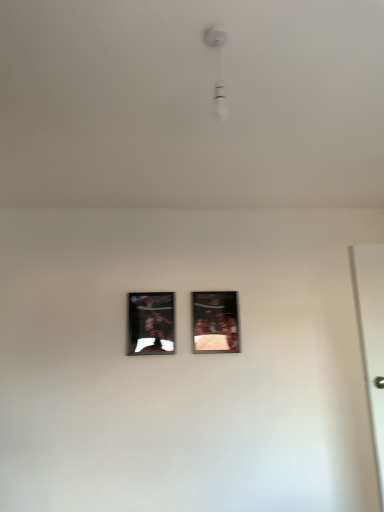
Image resolution: width=384 pixels, height=512 pixels. What are the coordinates of `metallic silver picture frame at center, which appears as the second picture frame when viewed from the left` in the screenshot? It's located at (215, 321).

Where is `metallic reflective frame at center, the 1th picture frame when ordered from left to right`? Image resolution: width=384 pixels, height=512 pixels. metallic reflective frame at center, the 1th picture frame when ordered from left to right is located at coordinates (151, 323).

The height and width of the screenshot is (512, 384). Describe the element at coordinates (217, 69) in the screenshot. I see `white glossy bulb at upper center` at that location.

Image resolution: width=384 pixels, height=512 pixels. In order to click on metallic silver picture frame at center, which is counted as the 1th picture frame, starting from the right in this screenshot , I will do `click(215, 321)`.

Considering the sizes of objects metallic silver picture frame at center, which is counted as the 1th picture frame, starting from the right, and metallic reflective frame at center, the 1th picture frame when ordered from left to right, in the image provided, who is wider, metallic silver picture frame at center, which is counted as the 1th picture frame, starting from the right, or metallic reflective frame at center, the 1th picture frame when ordered from left to right,?

With larger width is metallic silver picture frame at center, which is counted as the 1th picture frame, starting from the right.

Considering the positions of objects metallic silver picture frame at center, which is counted as the 1th picture frame, starting from the right, and metallic reflective frame at center, which is counted as the second picture frame, starting from the right, in the image provided, who is in front, metallic silver picture frame at center, which is counted as the 1th picture frame, starting from the right, or metallic reflective frame at center, which is counted as the second picture frame, starting from the right,?

metallic reflective frame at center, which is counted as the second picture frame, starting from the right.

Is metallic silver picture frame at center, which appears as the second picture frame when viewed from the left, facing towards metallic reflective frame at center, the 1th picture frame when ordered from left to right?

No, metallic silver picture frame at center, which appears as the second picture frame when viewed from the left, is not aimed at metallic reflective frame at center, the 1th picture frame when ordered from left to right.

Can you tell me how much metallic silver picture frame at center, which is counted as the 1th picture frame, starting from the right, and white glossy bulb at upper center differ in facing direction?

The angle between the facing direction of metallic silver picture frame at center, which is counted as the 1th picture frame, starting from the right, and the facing direction of white glossy bulb at upper center is 87.1 degrees.

Is metallic silver picture frame at center, which is counted as the 1th picture frame, starting from the right, spatially inside white glossy bulb at upper center, or outside of it?

metallic silver picture frame at center, which is counted as the 1th picture frame, starting from the right, cannot be found inside white glossy bulb at upper center.

Does metallic silver picture frame at center, which is counted as the 1th picture frame, starting from the right, have a lesser height compared to white glossy bulb at upper center?

No, metallic silver picture frame at center, which is counted as the 1th picture frame, starting from the right, is not shorter than white glossy bulb at upper center.

From the image's perspective, does metallic silver picture frame at center, which is counted as the 1th picture frame, starting from the right, appear lower than white glossy bulb at upper center?

Yes, from the image's perspective, metallic silver picture frame at center, which is counted as the 1th picture frame, starting from the right, is below white glossy bulb at upper center.

Considering the positions of objects metallic reflective frame at center, which is counted as the second picture frame, starting from the right, and white glossy bulb at upper center in the image provided, who is behind, metallic reflective frame at center, which is counted as the second picture frame, starting from the right, or white glossy bulb at upper center?

metallic reflective frame at center, which is counted as the second picture frame, starting from the right.

From the image's perspective, between metallic reflective frame at center, which is counted as the second picture frame, starting from the right, and white glossy bulb at upper center, which one is located above?

white glossy bulb at upper center.

In terms of height, does metallic reflective frame at center, which is counted as the second picture frame, starting from the right, look taller or shorter compared to white glossy bulb at upper center?

In the image, metallic reflective frame at center, which is counted as the second picture frame, starting from the right, appears to be taller than white glossy bulb at upper center.

From the image's perspective, is metallic reflective frame at center, the 1th picture frame when ordered from left to right, located beneath metallic silver picture frame at center, which is counted as the 1th picture frame, starting from the right?

Correct, metallic reflective frame at center, the 1th picture frame when ordered from left to right, appears lower than metallic silver picture frame at center, which is counted as the 1th picture frame, starting from the right, in the image.

From the picture: Is metallic reflective frame at center, the 1th picture frame when ordered from left to right, in front of or behind metallic silver picture frame at center, which appears as the second picture frame when viewed from the left, in the image?

metallic reflective frame at center, the 1th picture frame when ordered from left to right, is in front of metallic silver picture frame at center, which appears as the second picture frame when viewed from the left.

Is metallic reflective frame at center, which is counted as the second picture frame, starting from the right, wider or thinner than metallic silver picture frame at center, which is counted as the 1th picture frame, starting from the right?

Clearly, metallic reflective frame at center, which is counted as the second picture frame, starting from the right, has less width compared to metallic silver picture frame at center, which is counted as the 1th picture frame, starting from the right.

Which of these two, white glossy bulb at upper center or metallic silver picture frame at center, which appears as the second picture frame when viewed from the left, stands shorter?

Standing shorter between the two is white glossy bulb at upper center.

In the scene shown: Can you confirm if white glossy bulb at upper center is thinner than metallic silver picture frame at center, which appears as the second picture frame when viewed from the left?

No.

From the image's perspective, is white glossy bulb at upper center over metallic silver picture frame at center, which appears as the second picture frame when viewed from the left?

Correct, white glossy bulb at upper center appears higher than metallic silver picture frame at center, which appears as the second picture frame when viewed from the left, in the image.

In the image, there is a metallic silver picture frame at center, which is counted as the 1th picture frame, starting from the right. Where is `light fixture above it (from the image's perspective)`? This screenshot has width=384, height=512. light fixture above it (from the image's perspective) is located at coordinates (217, 69).

Can metallic reflective frame at center, the 1th picture frame when ordered from left to right, be found inside white glossy bulb at upper center?

No, metallic reflective frame at center, the 1th picture frame when ordered from left to right, is located outside of white glossy bulb at upper center.

Is white glossy bulb at upper center next to metallic reflective frame at center, the 1th picture frame when ordered from left to right, and touching it?

white glossy bulb at upper center and metallic reflective frame at center, the 1th picture frame when ordered from left to right, are clearly separated.

From a real-world perspective, between white glossy bulb at upper center and metallic reflective frame at center, which is counted as the second picture frame, starting from the right, who is vertically higher?

In real-world perspective, white glossy bulb at upper center is above.

Is metallic reflective frame at center, which is counted as the second picture frame, starting from the right, at the back of white glossy bulb at upper center?

No, white glossy bulb at upper center's orientation is not away from metallic reflective frame at center, which is counted as the second picture frame, starting from the right.

I want to click on picture frame below the metallic silver picture frame at center, which is counted as the 1th picture frame, starting from the right (from the image's perspective), so click(x=151, y=323).

The width and height of the screenshot is (384, 512). In order to click on light fixture above the metallic silver picture frame at center, which is counted as the 1th picture frame, starting from the right (from the image's perspective) in this screenshot , I will do `click(217, 69)`.

Looking at this image, from the image, which object appears to be nearer to metallic reflective frame at center, which is counted as the second picture frame, starting from the right, white glossy bulb at upper center or metallic silver picture frame at center, which is counted as the 1th picture frame, starting from the right?

metallic silver picture frame at center, which is counted as the 1th picture frame, starting from the right, is positioned closer to the anchor metallic reflective frame at center, which is counted as the second picture frame, starting from the right.

Based on their spatial positions, is white glossy bulb at upper center or metallic reflective frame at center, the 1th picture frame when ordered from left to right, closer to metallic silver picture frame at center, which is counted as the 1th picture frame, starting from the right?

metallic reflective frame at center, the 1th picture frame when ordered from left to right, is positioned closer to the anchor metallic silver picture frame at center, which is counted as the 1th picture frame, starting from the right.

Looking at the image, which one is located further to white glossy bulb at upper center, metallic reflective frame at center, which is counted as the second picture frame, starting from the right, or metallic silver picture frame at center, which appears as the second picture frame when viewed from the left?

metallic reflective frame at center, which is counted as the second picture frame, starting from the right.

Consider the image. From the image, which object appears to be farther from white glossy bulb at upper center, metallic silver picture frame at center, which appears as the second picture frame when viewed from the left, or metallic reflective frame at center, the 1th picture frame when ordered from left to right?

Among the two, metallic reflective frame at center, the 1th picture frame when ordered from left to right, is located further to white glossy bulb at upper center.

Estimate the real-world distances between objects in this image. Which object is further from metallic silver picture frame at center, which is counted as the 1th picture frame, starting from the right, metallic reflective frame at center, which is counted as the second picture frame, starting from the right, or white glossy bulb at upper center?

white glossy bulb at upper center is positioned further to the anchor metallic silver picture frame at center, which is counted as the 1th picture frame, starting from the right.

Looking at the image, which one is located closer to metallic reflective frame at center, which is counted as the second picture frame, starting from the right, metallic silver picture frame at center, which is counted as the 1th picture frame, starting from the right, or white glossy bulb at upper center?

metallic silver picture frame at center, which is counted as the 1th picture frame, starting from the right.

At what (x,y) coordinates should I click in order to perform the action: click on picture frame between white glossy bulb at upper center and metallic silver picture frame at center, which appears as the second picture frame when viewed from the left, from front to back. Please return your answer as a coordinate pair (x, y). The height and width of the screenshot is (512, 384). Looking at the image, I should click on (151, 323).